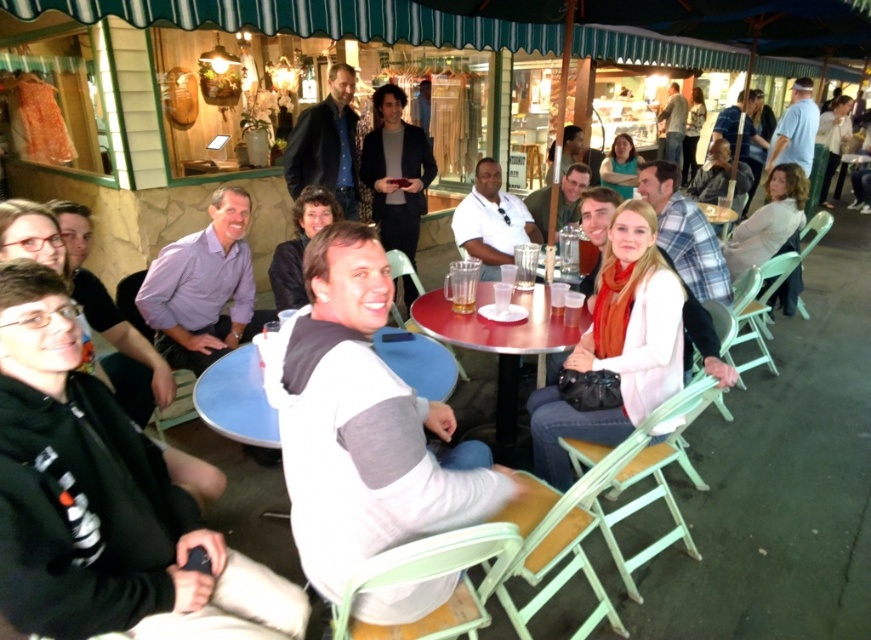
Question: Is gray fleece sweatshirt at center below black leather jacket at center?

Choices:
 (A) yes
 (B) no

Answer: (A)

Question: From the image, what is the correct spatial relationship of metallic red table at center in relation to dark brown leather jacket at center?

Choices:
 (A) right
 (B) left

Answer: (A)

Question: Among these points, which one is farthest from the camera?

Choices:
 (A) (246, 227)
 (B) (396, 234)

Answer: (B)

Question: In this image, where is dark gray wool sweater at center located relative to wooden table at center?

Choices:
 (A) left
 (B) right

Answer: (A)

Question: Considering the real-world distances, which object is farthest from the gray fleece sweatshirt at center?

Choices:
 (A) black leather jacket at center
 (B) white matte shirt at center
 (C) dark gray wool sweater at center

Answer: (C)

Question: Which point is farther to the camera?

Choices:
 (A) purple shirt at center
 (B) metallic red table at center
 (C) dark gray wool sweater at center

Answer: (C)